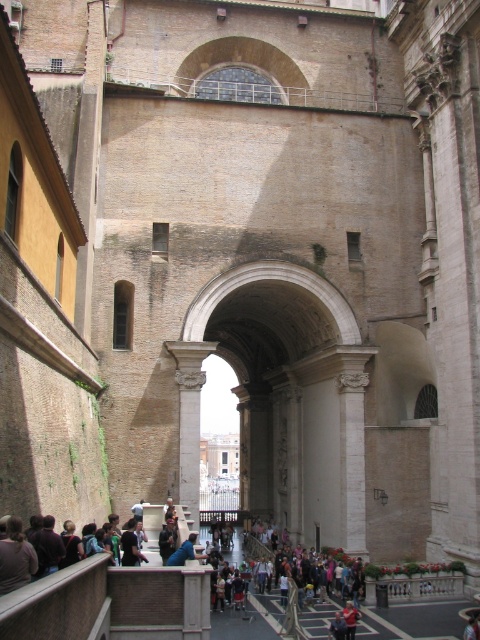
Does point (180, 556) come closer to viewer compared to point (478, 634)?

No.

The image size is (480, 640). What do you see at coordinates (183, 552) in the screenshot? I see `blue denim jeans at center` at bounding box center [183, 552].

This screenshot has height=640, width=480. Identify the location of blue denim jeans at center. (183, 552).